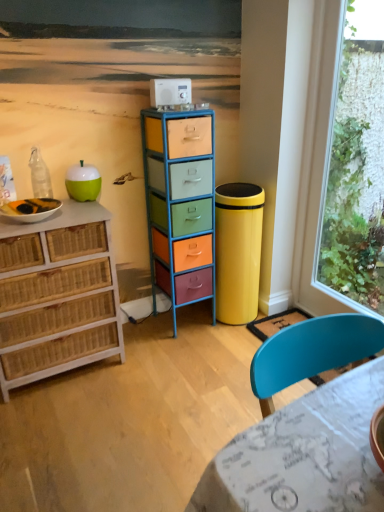
Locate an element on the screen. The width and height of the screenshot is (384, 512). free point to the right of white matte bowl at left is located at coordinates (80, 214).